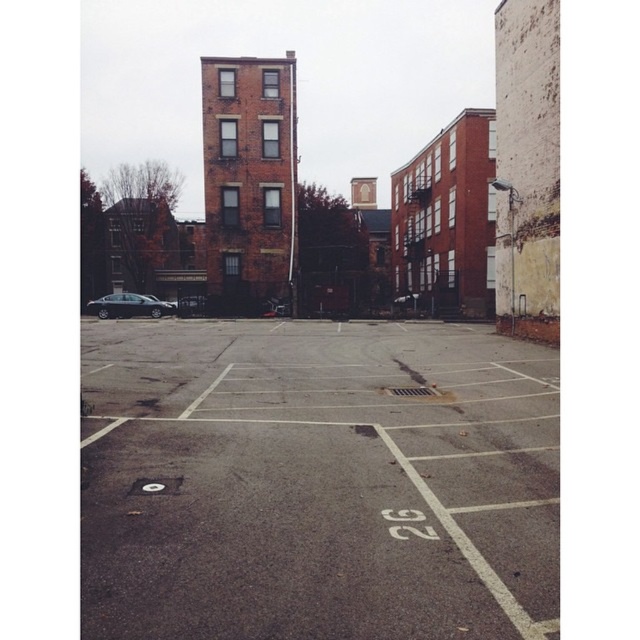
You are a delivery person who needs to park your truck, which is 20 feet long, in the parking lot. The parking spaces are marked by white lines. Can you fit your truck in the space between the gray asphalt parking lot at center and the shiny black sedan at left without overlapping the sedan?

The distance between the gray asphalt parking lot at center and the shiny black sedan at left is 85.30 feet. Since your truck is only 20 feet long, there is sufficient space to park without overlapping the sedan.

You are standing in the parking lot and want to walk to the shiny black sedan at left. Which direction should you move relative to the gray asphalt parking lot at center?

Since the gray asphalt parking lot at center is closer to the viewer than the shiny black sedan at left, you should move towards the left to reach the shiny black sedan at left.